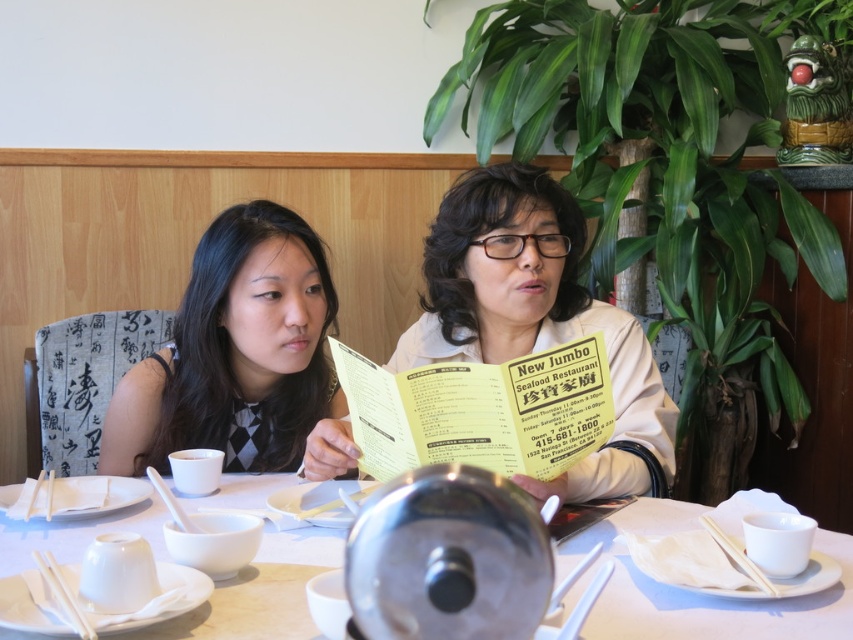
Question: Can you confirm if beige fabric jacket at center is positioned to the right of black textured dress at left?

Choices:
 (A) no
 (B) yes

Answer: (B)

Question: Which point is farther to the camera?

Choices:
 (A) white ceramic table at center
 (B) yellow paper menu at center

Answer: (B)

Question: Does beige fabric jacket at center have a lesser width compared to white ceramic table at center?

Choices:
 (A) no
 (B) yes

Answer: (B)

Question: Which of the following is the farthest from the observer?

Choices:
 (A) (514, 307)
 (B) (515, 368)
 (C) (672, 627)
 (D) (242, 376)

Answer: (D)

Question: Among these points, which one is farthest from the camera?

Choices:
 (A) (291, 358)
 (B) (549, 387)
 (C) (167, 621)
 (D) (642, 435)

Answer: (A)

Question: Is black textured dress at left in front of white ceramic table at center?

Choices:
 (A) yes
 (B) no

Answer: (B)